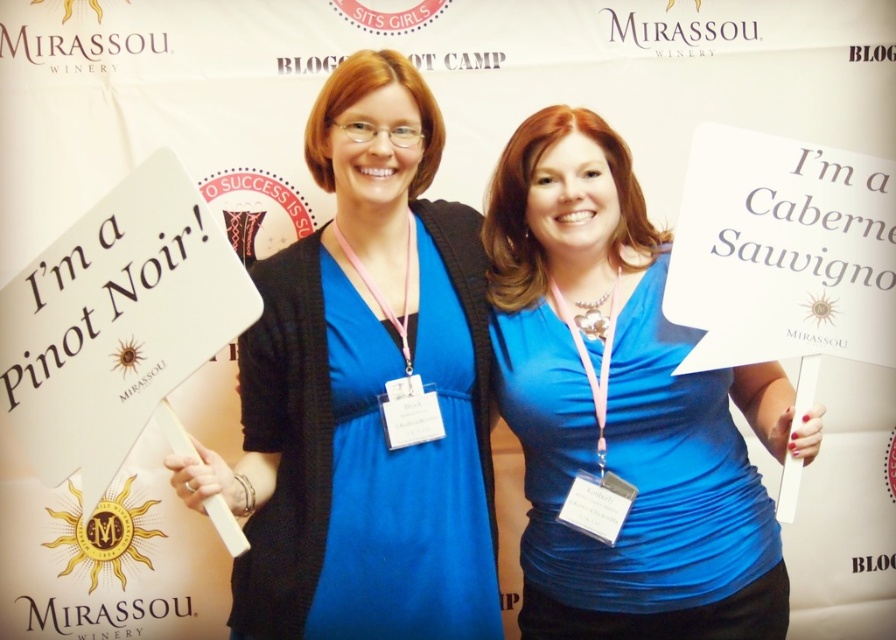
You are organizing a photoshoot and need to decide which clothing item to feature based on their size. Given the blue matte dress at center and the matte blue shirt at center, which one is narrower?

The blue matte dress at center is narrower than the matte blue shirt at center.

You are attending a wine tasting event and notice two people wearing blue clothing. One is wearing a blue matte dress at center and the other a matte blue shirt at center. According to the scene, which clothing item is positioned higher on their body?

The blue matte dress at center is located above the matte blue shirt at center, so the dress is positioned higher on the body.

You are a fashion designer observing the two women in the image. You need to determine if the blue matte dress at center and the matte blue shirt at center can be displayed side by side in a 16 inch wide display case. Can they fit without overlapping?

The blue matte dress at center and matte blue shirt at center are 15.24 inches apart, so they can fit in a 16 inch wide display case since the total space required is less than the case width.